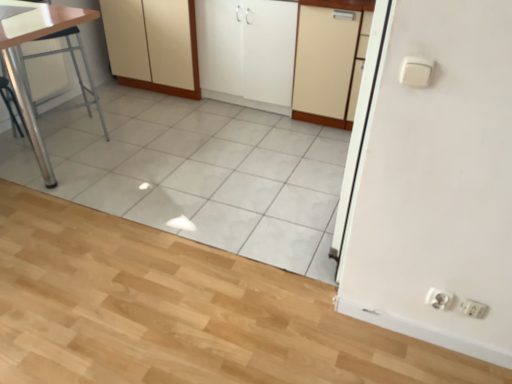
Question: Considering the relative sizes of beige matte cabinet at center, the third cabinetry when ordered from left to right, and white matte cabinet at center, which ranks as the 2th cabinetry in right-to-left order, in the image provided, is beige matte cabinet at center, the third cabinetry when ordered from left to right, smaller than white matte cabinet at center, which ranks as the 2th cabinetry in right-to-left order,?

Choices:
 (A) no
 (B) yes

Answer: (B)

Question: From a real-world perspective, is beige matte cabinet at center, which is the 1th cabinetry from right to left, on white matte cabinet at center, the second cabinetry viewed from the left?

Choices:
 (A) no
 (B) yes

Answer: (B)

Question: Can you confirm if beige matte cabinet at center, which is the 1th cabinetry from right to left, is bigger than white matte cabinet at center, which ranks as the 2th cabinetry in right-to-left order?

Choices:
 (A) no
 (B) yes

Answer: (A)

Question: Can you see beige matte cabinet at center, the third cabinetry when ordered from left to right, touching white matte cabinet at center, which ranks as the 2th cabinetry in right-to-left order?

Choices:
 (A) yes
 (B) no

Answer: (B)

Question: Is beige matte cabinet at center, the third cabinetry when ordered from left to right, aimed at white matte cabinet at center, the second cabinetry viewed from the left?

Choices:
 (A) no
 (B) yes

Answer: (A)

Question: Is white glossy sink at upper left taller or shorter than metallic silver table at left?

Choices:
 (A) tall
 (B) short

Answer: (B)

Question: Based on their sizes in the image, would you say white glossy sink at upper left is bigger or smaller than metallic silver table at left?

Choices:
 (A) small
 (B) big

Answer: (A)

Question: Considering their positions, is white glossy sink at upper left located in front of or behind metallic silver table at left?

Choices:
 (A) front
 (B) behind

Answer: (A)

Question: Choose the correct answer: Is white glossy sink at upper left inside metallic silver table at left or outside it?

Choices:
 (A) outside
 (B) inside

Answer: (A)

Question: Is white plastic electric outlet at lower right, the 1th electric outlet in the left-to-right sequence, in front of or behind white matte cabinet at center, the 3th cabinetry when ordered from right to left, in the image?

Choices:
 (A) front
 (B) behind

Answer: (A)

Question: Is white plastic electric outlet at lower right, the 1th electric outlet in the left-to-right sequence, inside or outside of white matte cabinet at center, the 3th cabinetry when ordered from right to left?

Choices:
 (A) outside
 (B) inside

Answer: (A)

Question: Does point (440, 307) appear closer or farther from the camera than point (186, 69)?

Choices:
 (A) farther
 (B) closer

Answer: (B)

Question: From a real-world perspective, is white plastic electric outlet at lower right, the 1th electric outlet in the left-to-right sequence, physically located above or below white matte cabinet at center, the 3th cabinetry when ordered from right to left?

Choices:
 (A) above
 (B) below

Answer: (B)

Question: From the image's perspective, is white matte cabinet at center, the second cabinetry viewed from the left, above or below white glossy sink at upper left?

Choices:
 (A) above
 (B) below

Answer: (A)

Question: Looking at their shapes, would you say white matte cabinet at center, the second cabinetry viewed from the left, is wider or thinner than white glossy sink at upper left?

Choices:
 (A) thin
 (B) wide

Answer: (B)